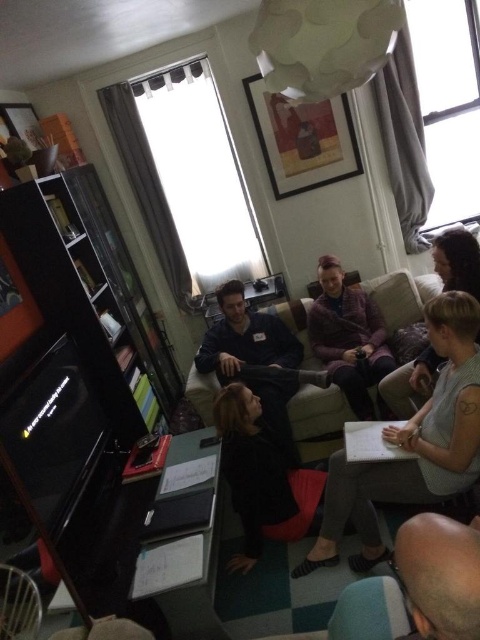
You are organizing a small event and need to decide which object to place in a specific area. Given the dark blue fleece jacket at center and the velvet green armchair at lower center, which one would require more space due to its size?

The dark blue fleece jacket at center requires more space because it has a larger size compared to the velvet green armchair at lower center.

You are a delivery robot with a package that needs to be placed between the dark blue fleece jacket at center and the wooden armchair at lower left. The package requires 1.5 meters of space. Can you fit it there?

The dark blue fleece jacket at center and wooden armchair at lower left are 1.66 meters apart, so yes, the package requiring 1.5 meters of space can fit between them since the distance is sufficient.

You are organizing a small event in the living room and need to place a decorative pillow on the velvet green armchair at lower center. However, there is a dark blue fleece jacket at center currently occupying the space. Can you place the pillow there without moving the jacket?

The dark blue fleece jacket at center is positioned over the velvet green armchair at lower center, so placing the decorative pillow there would require moving the jacket first.